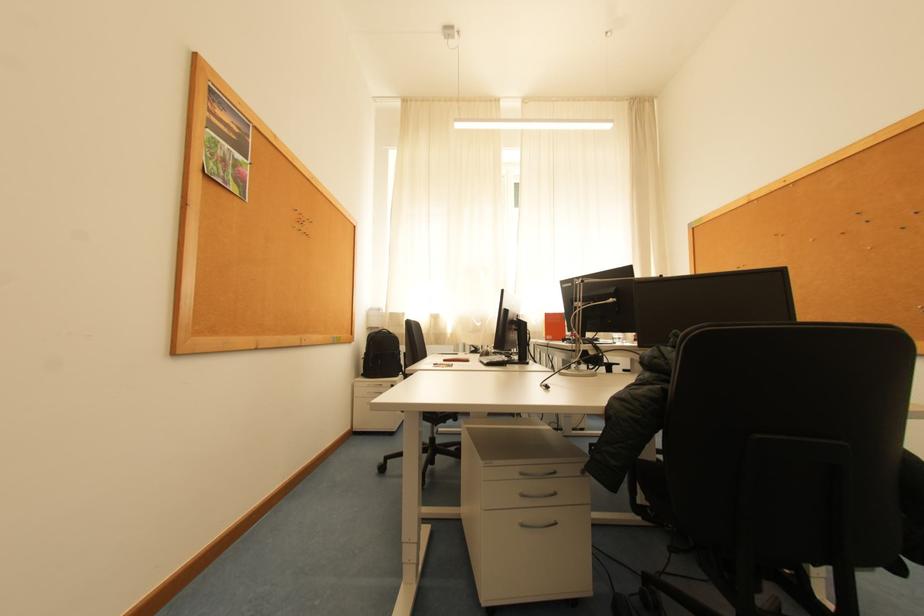
The height and width of the screenshot is (616, 924). Identify the location of computer mouse. click(544, 386).